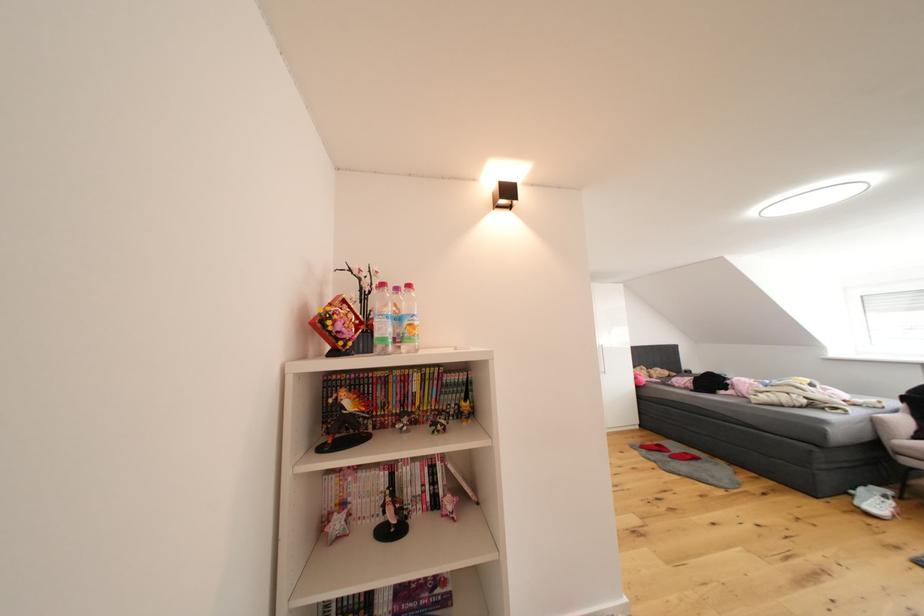
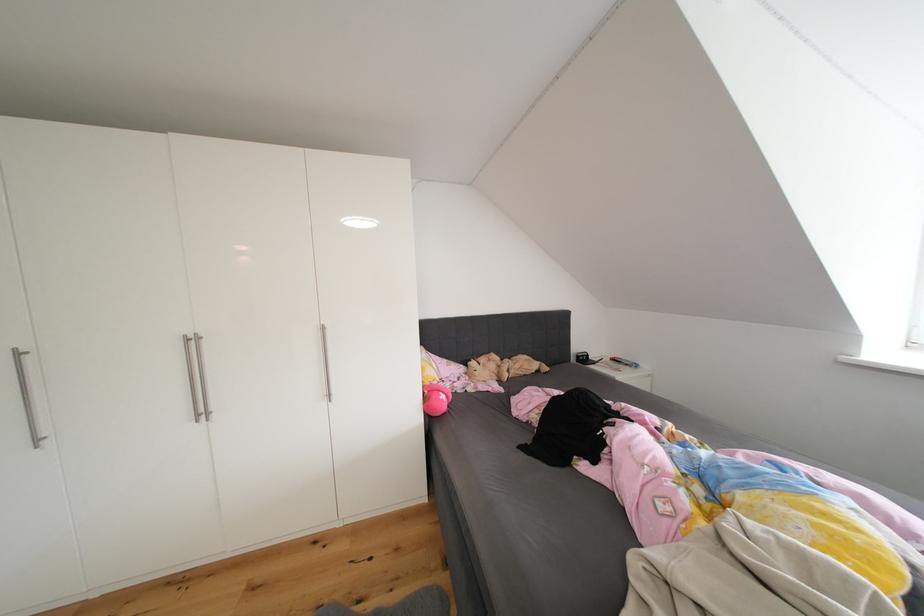
The images are taken continuously from a first-person perspective. In which direction are you moving?

The cameraman moved toward right, forward.